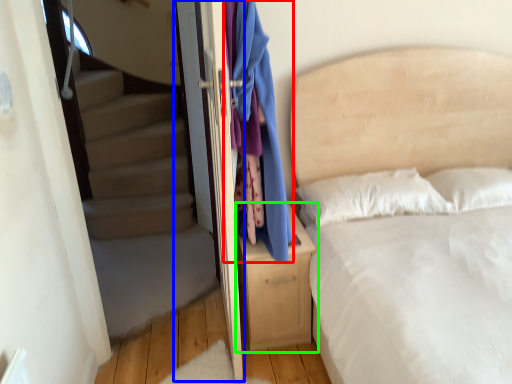
Question: Which object is positioned closest to clothing (highlighted by a red box)? Select from screen door (highlighted by a blue box) and nightstand (highlighted by a green box).

Choices:
 (A) screen door
 (B) nightstand

Answer: (B)